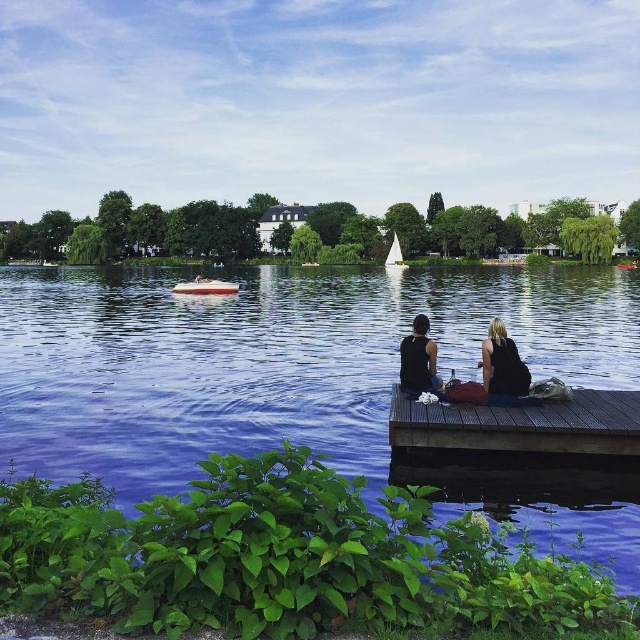
Question: Considering the relative positions of blue water at center and black matte tank top at center in the image provided, where is blue water at center located with respect to black matte tank top at center?

Choices:
 (A) above
 (B) below

Answer: (A)

Question: Estimate the real-world distances between objects in this image. Which object is farther from the white plastic boat at center?

Choices:
 (A) black fabric couple at center
 (B) blonde hair at center
 (C) black matte tank top at center
 (D) brown wooden dock at lower center

Answer: (B)

Question: Which point appears farthest from the camera in this image?

Choices:
 (A) (488, 385)
 (B) (173, 292)
 (C) (6, 276)
 (D) (435, 360)

Answer: (C)

Question: Which object appears closest to the camera in this image?

Choices:
 (A) black matte tank top at center
 (B) white plastic boat at center
 (C) black fabric couple at center
 (D) blue water at center

Answer: (D)

Question: Is black fabric couple at center wider than white plastic boat at center?

Choices:
 (A) yes
 (B) no

Answer: (B)

Question: Is black matte tank top at center bigger than white plastic boat at center?

Choices:
 (A) yes
 (B) no

Answer: (B)